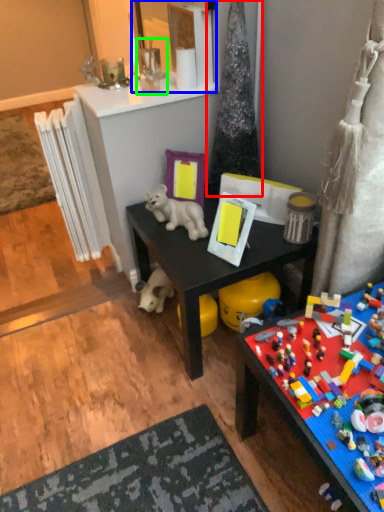
Question: Which object is positioned closest to christmas tree (highlighted by a red box)? Select from mirror (highlighted by a blue box) and toy (highlighted by a green box).

Choices:
 (A) mirror
 (B) toy

Answer: (A)